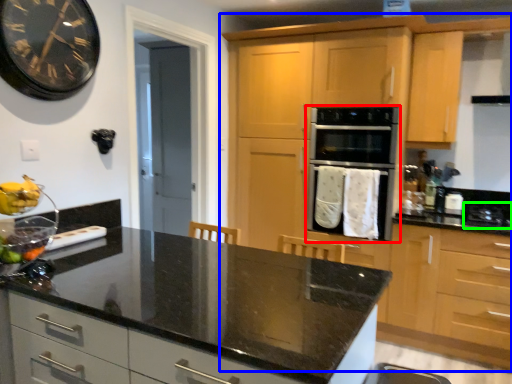
Question: Which object is the farthest from oven (highlighted by a red box)? Choose among these: cabinetry (highlighted by a blue box) or gas stove (highlighted by a green box).

Choices:
 (A) cabinetry
 (B) gas stove

Answer: (B)